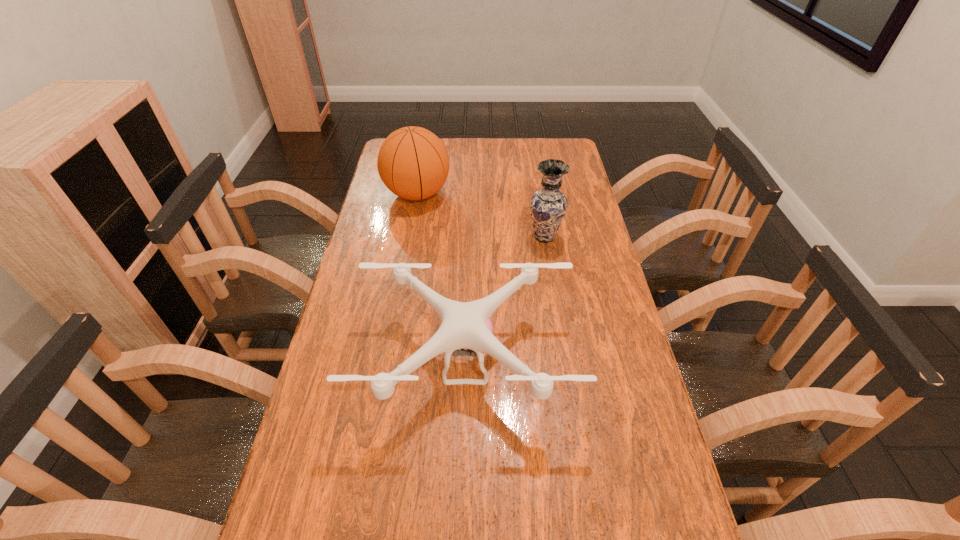
I want to click on vase, so click(x=548, y=206).

This screenshot has width=960, height=540. I want to click on the farthest object, so click(413, 163).

Where is `drone`? This screenshot has height=540, width=960. drone is located at coordinates (467, 325).

This screenshot has width=960, height=540. I want to click on the nearest object, so click(467, 325).

The image size is (960, 540). Identify the location of blank space located 0.250m on the front of the vase. (556, 307).

Locate an element on the screen. The image size is (960, 540). blank space located 0.060m on the front of the farthest object is located at coordinates (412, 225).

Where is `vacant area located 0.080m on the top of the nearest object`? vacant area located 0.080m on the top of the nearest object is located at coordinates (463, 468).

This screenshot has width=960, height=540. What are the coordinates of `basketball present at the left edge` in the screenshot? It's located at (413, 163).

Where is `drone located at the left edge`? drone located at the left edge is located at coordinates (467, 325).

Locate an element on the screen. Image resolution: width=960 pixels, height=540 pixels. object present at the right edge is located at coordinates (548, 206).